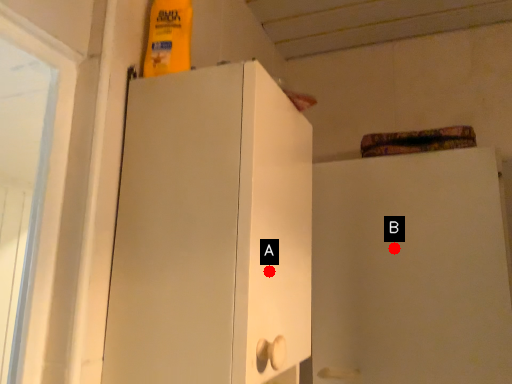
Question: Two points are circled on the image, labeled by A and B beside each circle. Which point appears closest to the camera in this image?

Choices:
 (A) A is closer
 (B) B is closer

Answer: (A)